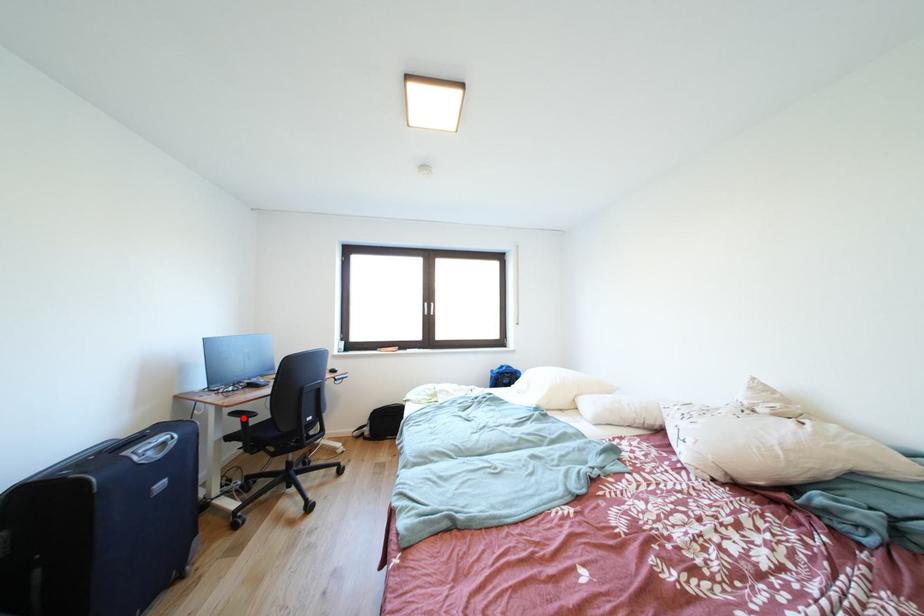
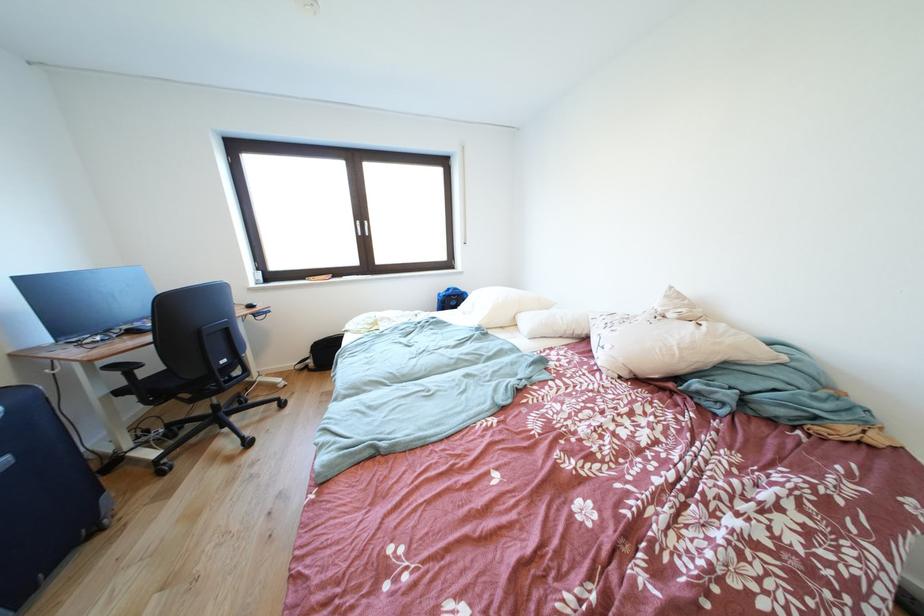
Locate, in the second image, the point that corresponds to the highlighted location in the first image.

(120, 371)